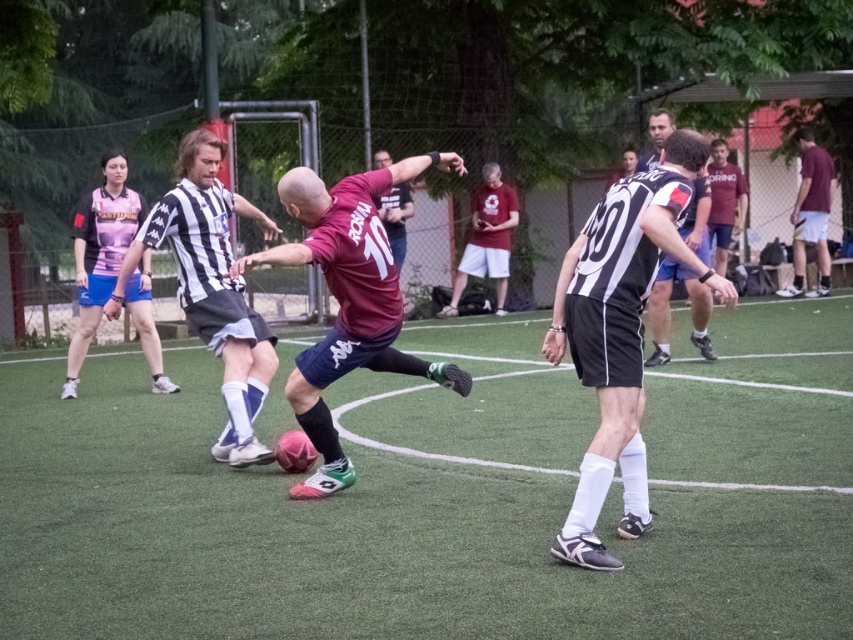
You are a photographer positioned at the edge of the soccer field. You want to capture a closeup shot of the black and white striped jersey at center. Given that your camera can focus on objects within 5 meters, will you be able to take the photo without moving closer?

The black and white striped jersey at center is 6.25 meters away from the camera. Since the camera can only focus on objects within 5 meters, you will need to move closer to take the closeup shot.